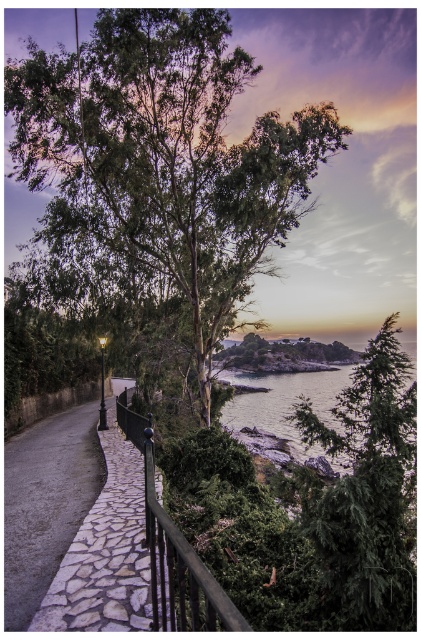
You are a landscape architect designing a walking path. You need to determine if the green textured tree at right can be pruned to allow more space for visitors without removing the black metal rail at center. Based on their sizes, is this feasible?

The green textured tree at right occupies less space than the black metal rail at center, so pruning the tree could provide additional space for visitors while keeping the rail intact.

You are standing at the point closer to the camera between the two points, point (213, 173) and point (152, 572). Which point are you standing at?

You are standing at point (213, 173) because it is further to the camera than point (152, 572).